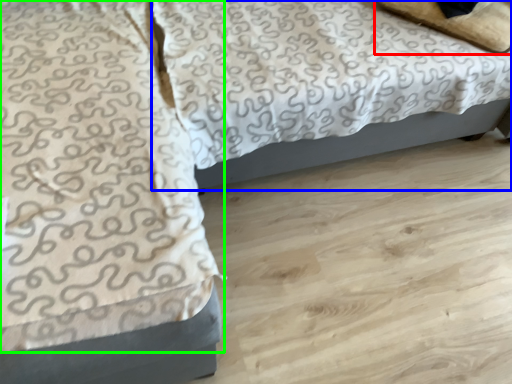
Question: Which is nearer to the pillow (highlighted by a red box)? bed (highlighted by a blue box) or blanket (highlighted by a green box).

Choices:
 (A) bed
 (B) blanket

Answer: (A)